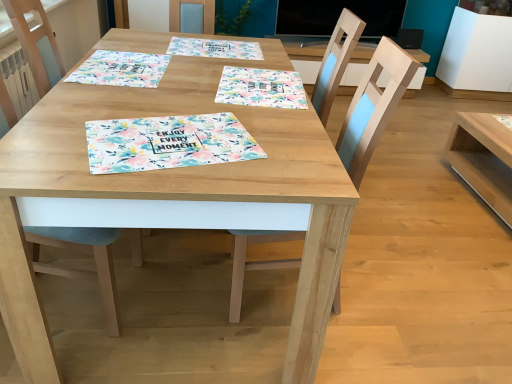
Where is `vacant space to the right of floral paper placemat at center`? vacant space to the right of floral paper placemat at center is located at coordinates (286, 150).